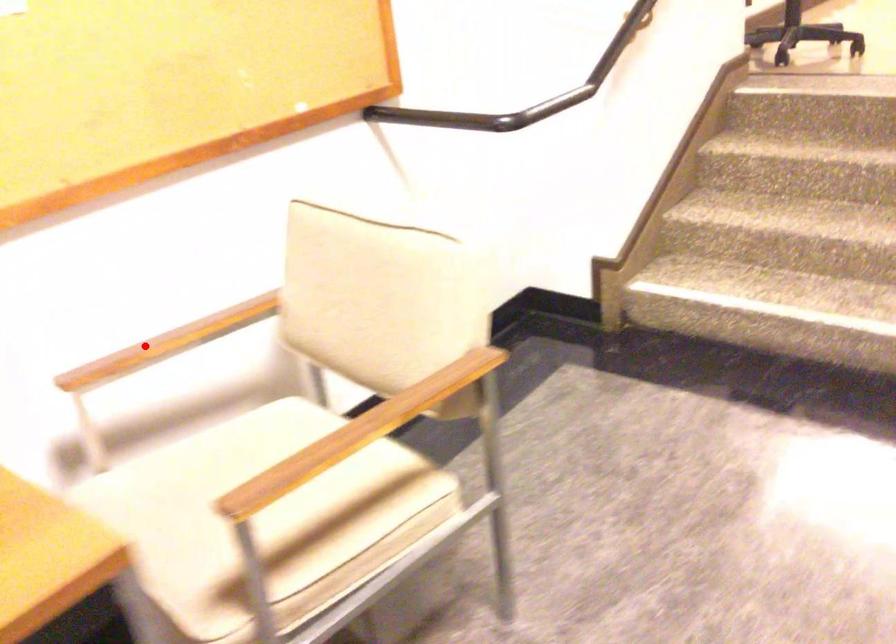
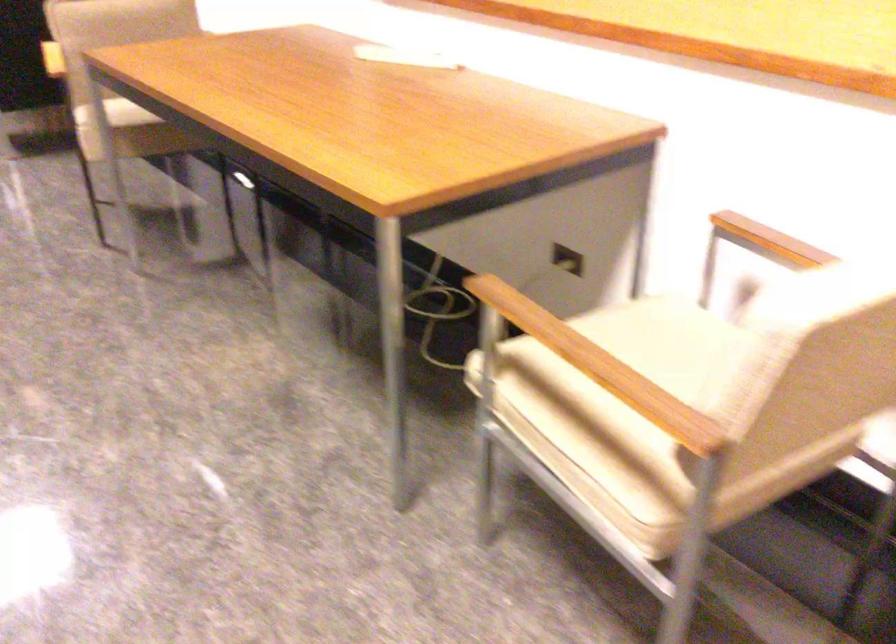
The point at the highlighted location is marked in the first image. Where is the corresponding point in the second image?

(771, 240)